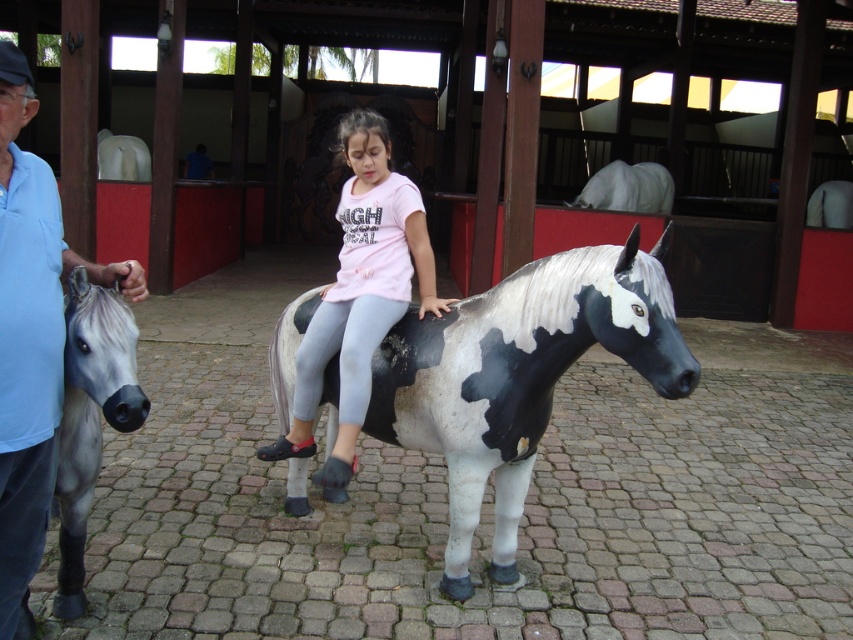
Is smooth gray horse at left further to the viewer compared to gray matte horse at left?

That is False.

Where is `smooth gray horse at left`? The image size is (853, 640). smooth gray horse at left is located at coordinates (32, 333).

The height and width of the screenshot is (640, 853). Identify the location of painted wood horse at center. (518, 376).

Does point (473, 467) come closer to viewer compared to point (360, 237)?

Yes, it is in front of point (360, 237).

Does point (444, 593) come farther from viewer compared to point (363, 168)?

No, (444, 593) is closer to viewer.

In order to click on painted wood horse at center in this screenshot , I will do click(x=518, y=376).

Which of these two, matte pink shirt at center or gray matte horse at left, stands shorter?

gray matte horse at left

Can you confirm if matte pink shirt at center is positioned to the left of gray matte horse at left?

Incorrect, matte pink shirt at center is not on the left side of gray matte horse at left.

The height and width of the screenshot is (640, 853). Identify the location of matte pink shirt at center. pos(358,296).

The width and height of the screenshot is (853, 640). In order to click on matte pink shirt at center in this screenshot , I will do `click(358, 296)`.